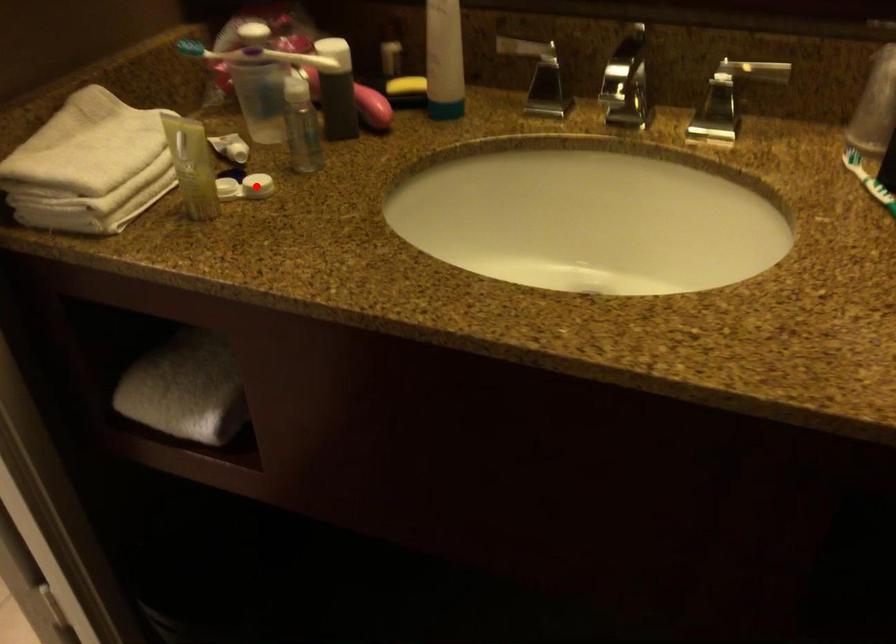
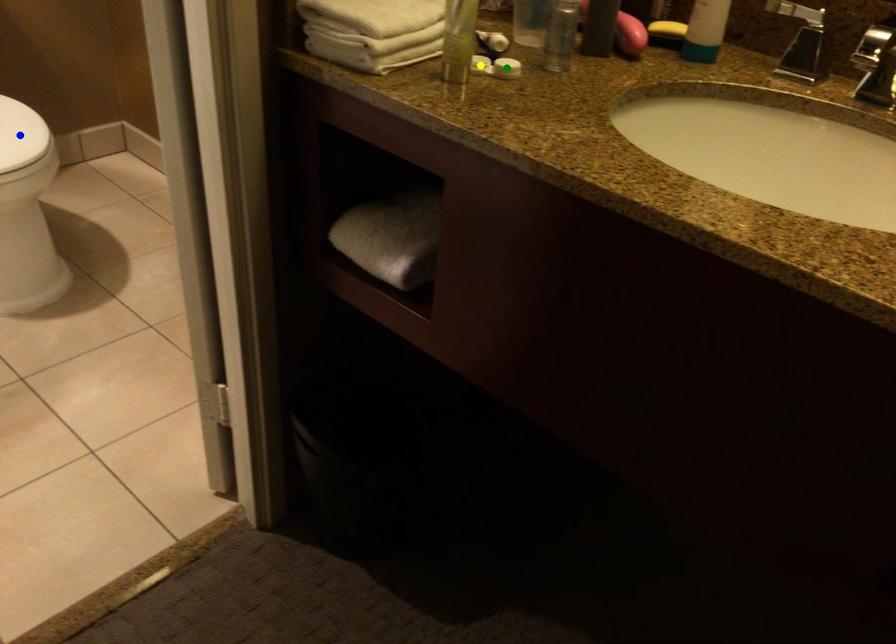
Question: I am providing you with two images of the same scene from different viewpoints. A red point is marked on the first image. You are given multiple points on the second image. Which point in image 2 represents the same 3d spot as the red point in image 1?

Choices:
 (A) green point
 (B) blue point
 (C) yellow point

Answer: (A)